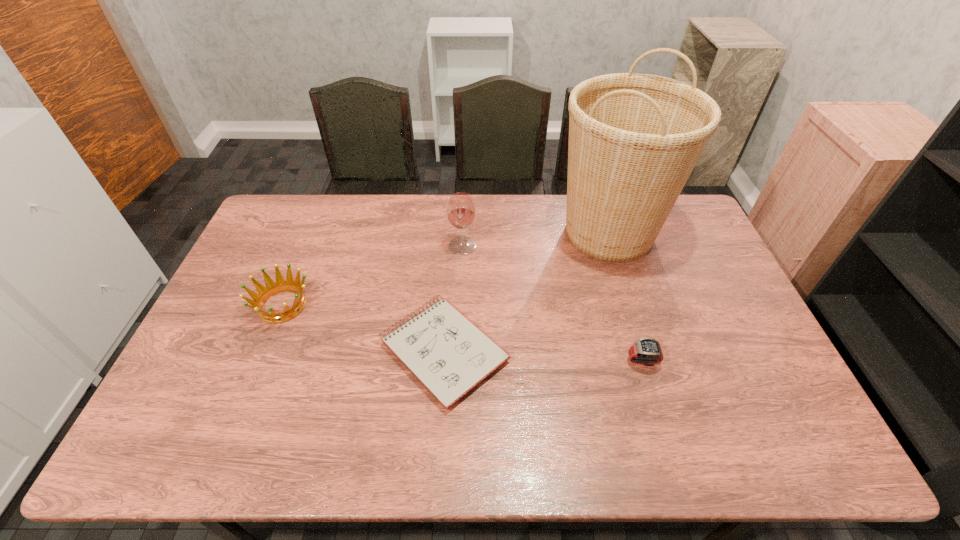
Image resolution: width=960 pixels, height=540 pixels. I want to click on the fourth closest object to the watch, so (x=264, y=293).

You are a GUI agent. You are given a task and a screenshot of the screen. Output one action in this format:
    pyautogui.click(x=<x>, y=<y>)
    Task: Click on the fourth closest object to the fourth shortest object
    
    Given the screenshot: What is the action you would take?
    pyautogui.click(x=646, y=351)

Locate an element on the screen. The image size is (960, 540). free spot that satisfies the following two spatial constraints: 1. on the front side of the watch; 2. on the left side of the notepad is located at coordinates (444, 360).

Locate an element on the screen. free space that satisfies the following two spatial constraints: 1. on the back side of the tallest object; 2. on the right side of the second tallest object is located at coordinates (463, 233).